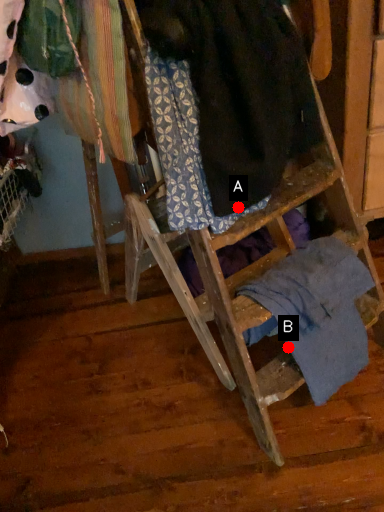
Question: Two points are circled on the image, labeled by A and B beside each circle. Among these points, which one is nearest to the camera?

Choices:
 (A) A is closer
 (B) B is closer

Answer: (A)